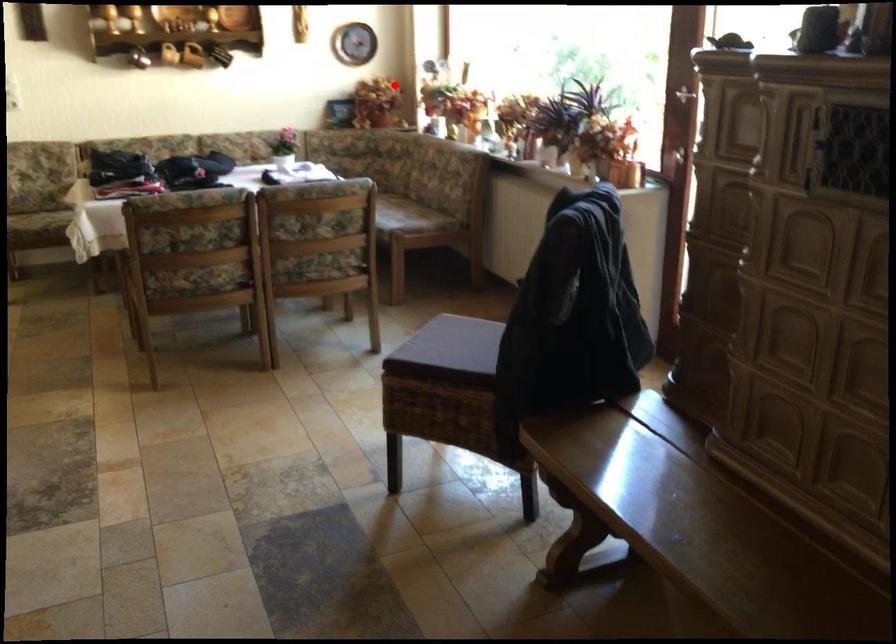
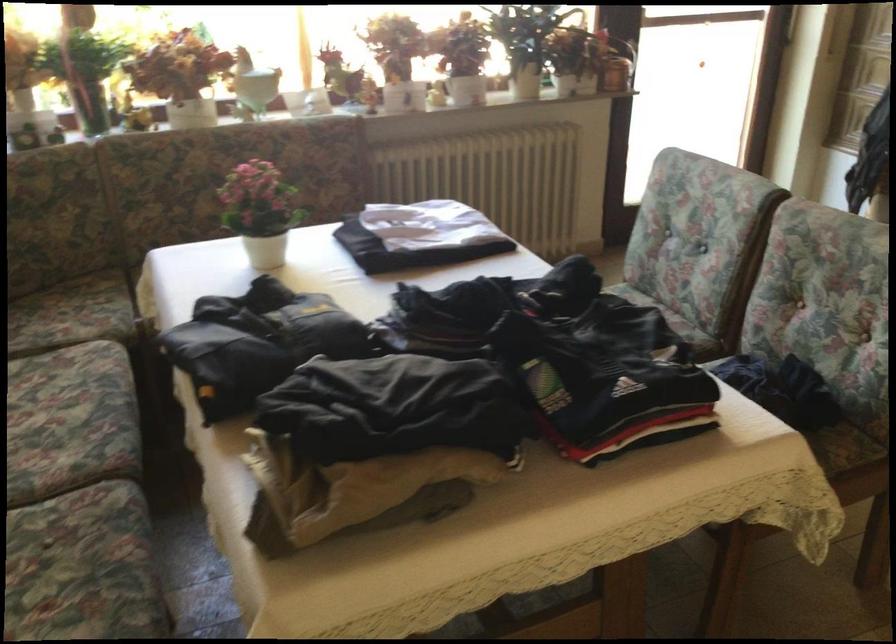
Question: I am providing you with two images of the same scene from different viewpoints. A red point is shown in image1. For the corresponding object point in image2, is it positioned nearer or farther from the camera?

Choices:
 (A) Nearer
 (B) Farther

Answer: (A)